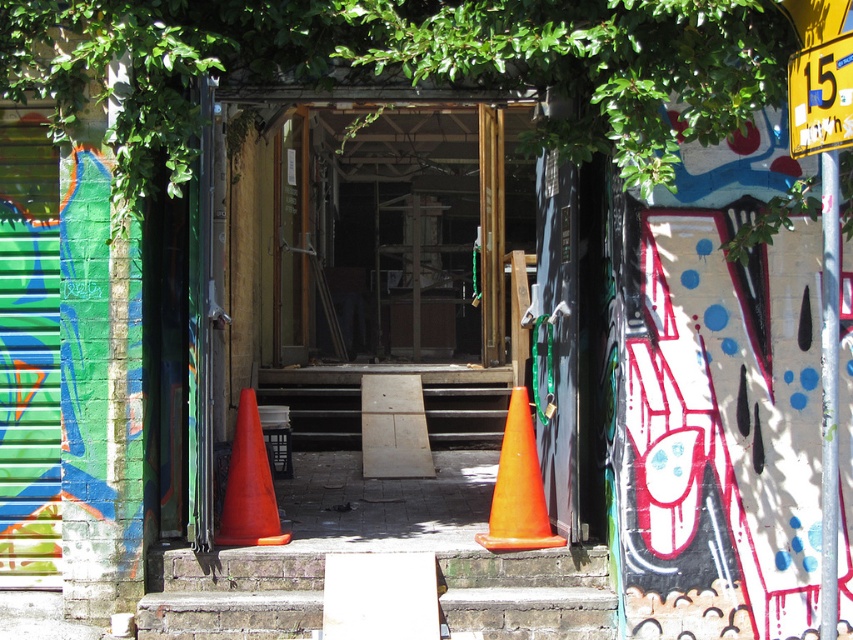
Question: Estimate the real-world distances between objects in this image. Which object is farther from the wooden at center?

Choices:
 (A) green leafy tree at upper center
 (B) orange matte traffic cone at center

Answer: (A)

Question: Does brick stairs at center appear on the right side of orange matte traffic cone at center?

Choices:
 (A) no
 (B) yes

Answer: (B)

Question: Does brick stairs at center have a greater width compared to orange plastic traffic cone at center?

Choices:
 (A) no
 (B) yes

Answer: (B)

Question: Can you confirm if green leafy tree at upper center is smaller than orange matte traffic cone at center?

Choices:
 (A) yes
 (B) no

Answer: (B)

Question: Which is nearer to the yellow plastic street sign at upper right?

Choices:
 (A) brick stairs at center
 (B) green leafy tree at upper center

Answer: (B)

Question: Which point is farther to the camera?

Choices:
 (A) (700, 3)
 (B) (825, 68)

Answer: (A)